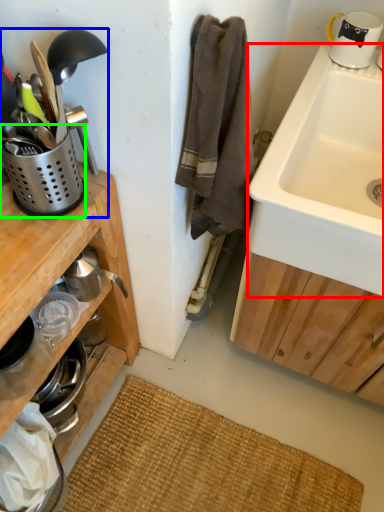
Question: Based on their relative distances, which object is nearer to sink (highlighted by a red box)? Choose from appliance (highlighted by a blue box) and appliance (highlighted by a green box).

Choices:
 (A) appliance
 (B) appliance

Answer: (A)